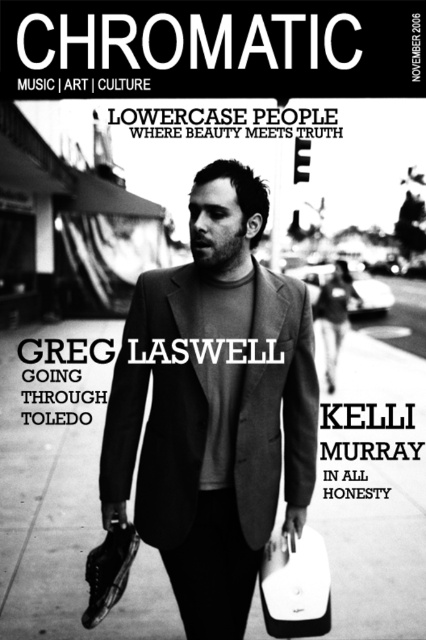
You are standing in front of the magazine cover and want to touch both points mentioned. Which point should you reach for first, the point at coordinates point [259,490] or point [307,563]?

You should reach for point [259,490] first because it is closer to you than point [307,563].

You are designing a layout for a magazine cover and need to place a watermark. The watermark should be placed to the left of the matte black suit at center. According to the magazine cover scene, where should you position the watermark?

The watermark should be placed to the left of the matte black suit at center, which is located at point 0.636 on the horizontal axis and 0.502 on the vertical axis. Therefore, position the watermark slightly to the left of the coordinates (213, 406) to ensure it is to the left of the matte black suit at center.